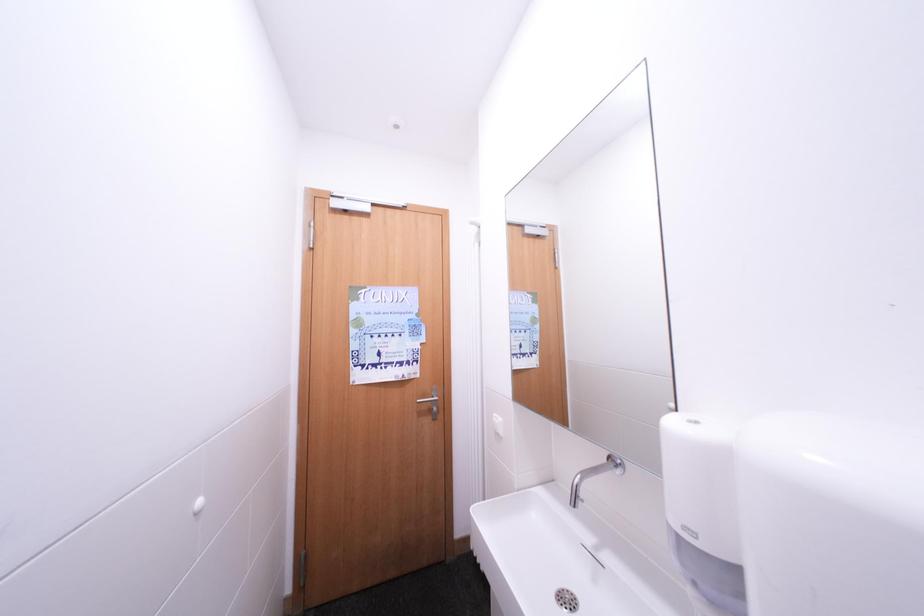
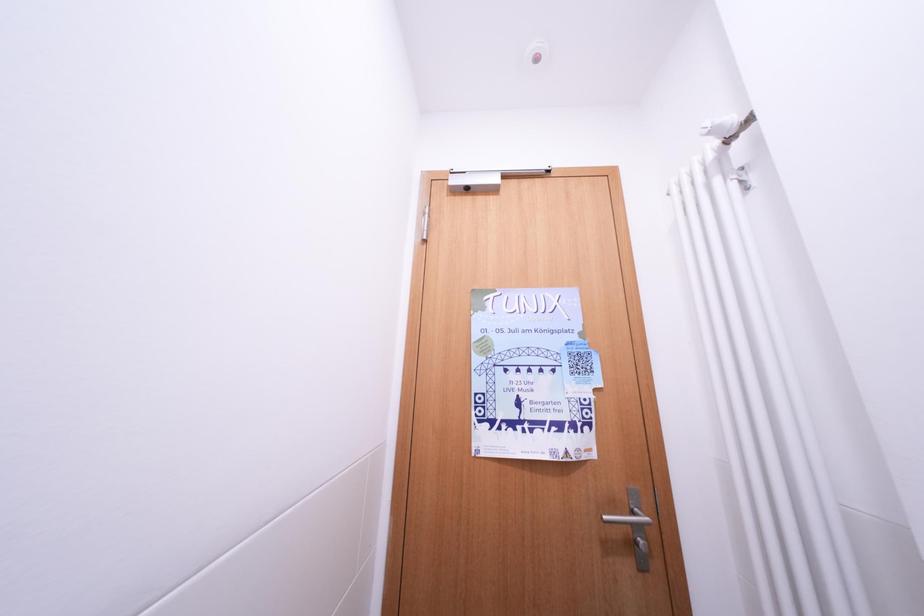
The images are taken continuously from a first-person perspective. In which direction are you moving?

The cameraman walked toward left, forward.